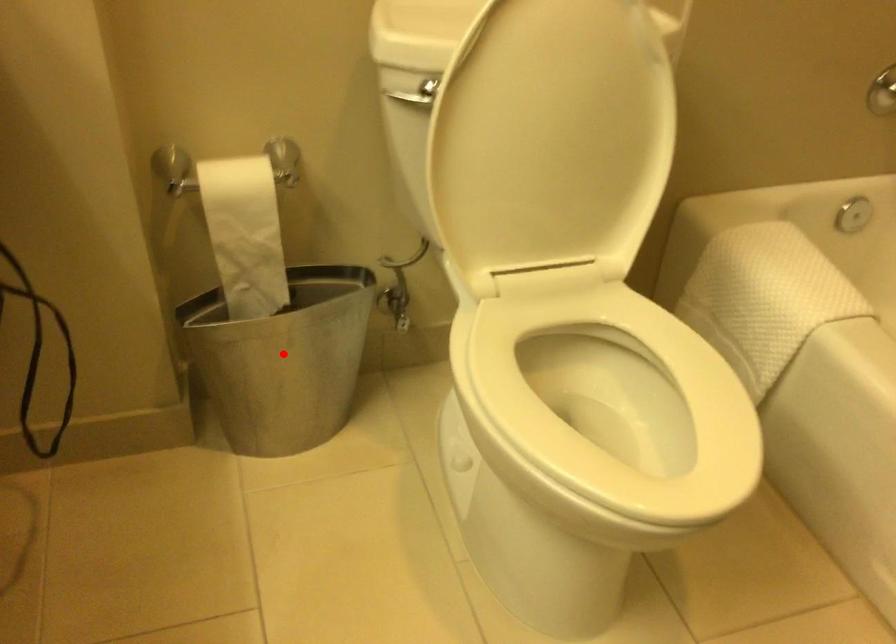
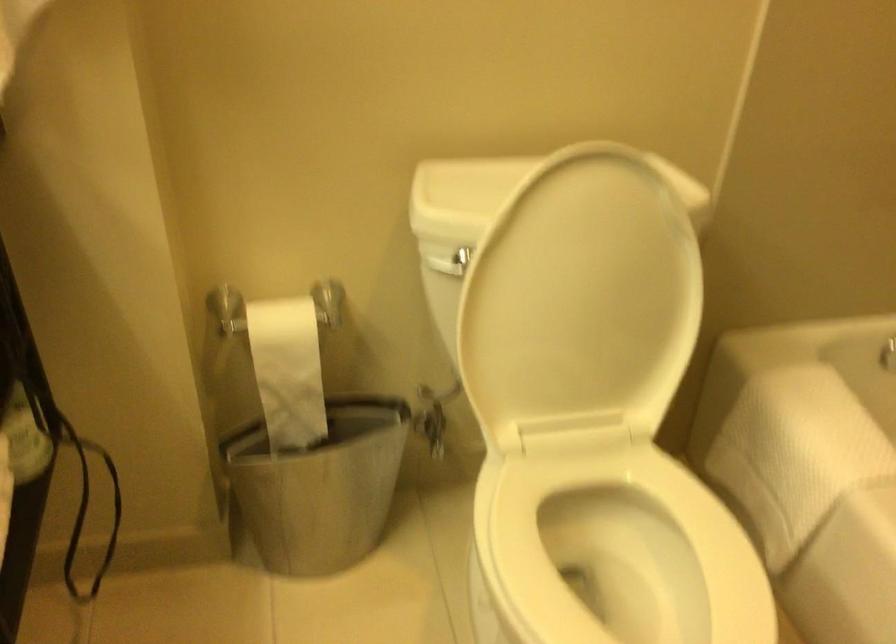
Find the pixel in the second image that matches the highlighted location in the first image.

(319, 487)